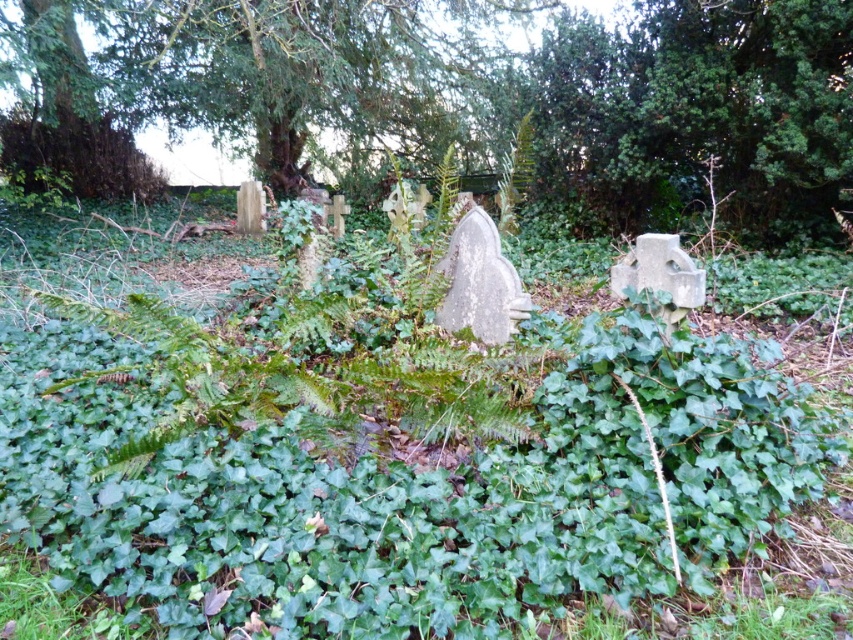
You are a gardener assessing the cemetery scene. You notice the green leafy tree at upper center and the green leafy bush at upper left. Which one has a greater height?

The green leafy bush at upper left is taller than the green leafy tree at upper center.

You are standing in the cemetery scene and want to locate the point marked as point (247, 77). Based on the description, where would you look to find this point?

The point (247, 77) is located on the green leafy tree at upper center.